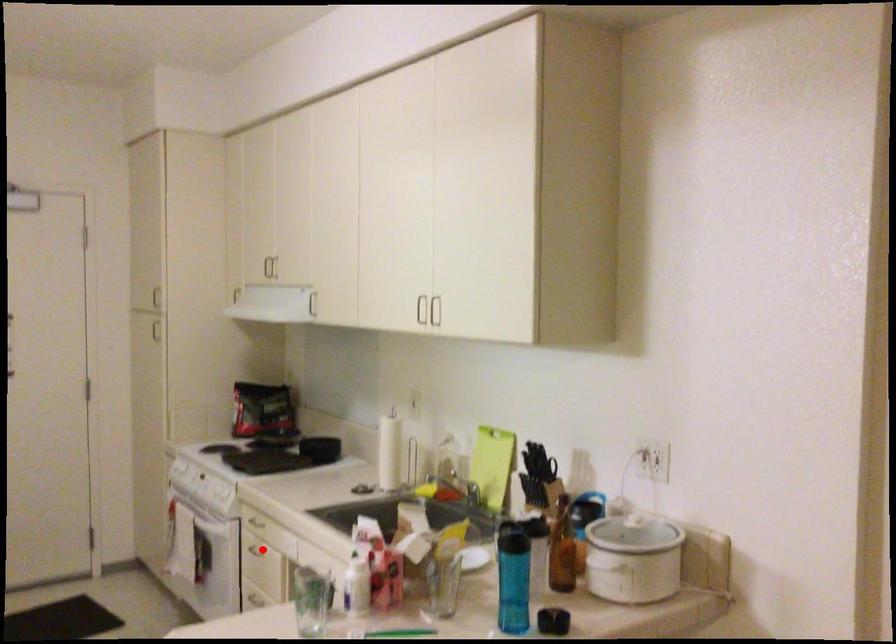
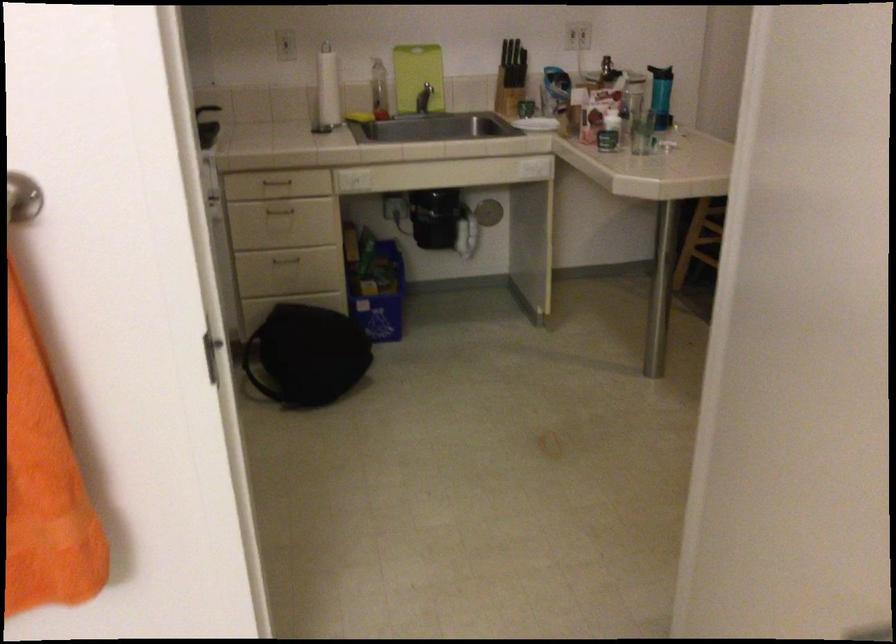
Find the pixel in the second image that matches the highlighted location in the first image.

(279, 210)